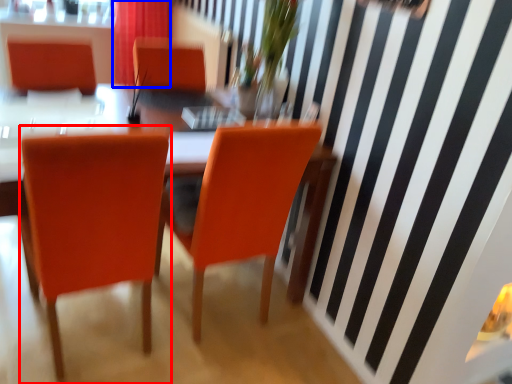
Question: Which object appears closest to the camera in this image, chair (highlighted by a red box) or curtain (highlighted by a blue box)?

Choices:
 (A) chair
 (B) curtain

Answer: (A)